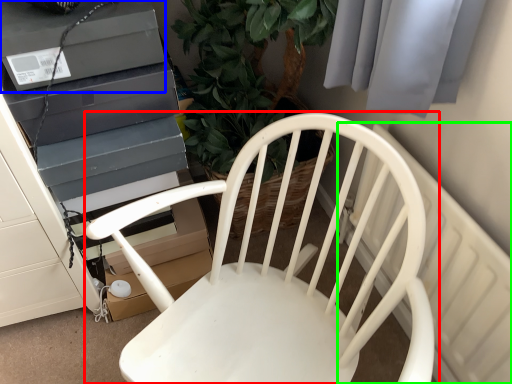
Question: Which object is positioned farthest from chair (highlighted by a red box)? Select from appliance (highlighted by a blue box) and radiator (highlighted by a green box).

Choices:
 (A) appliance
 (B) radiator

Answer: (A)